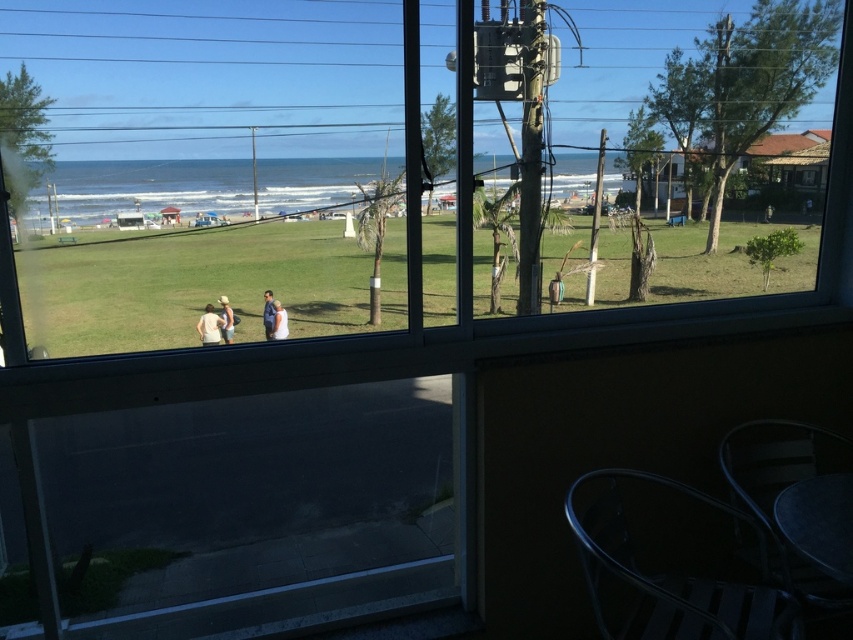
Between light brown fabric shirt at center and white cotton shirt at center, which one is positioned lower?

Positioned lower is light brown fabric shirt at center.

Who is positioned more to the right, light brown fabric shirt at center or white cotton shirt at center?

white cotton shirt at center

Which is in front, point (212, 305) or point (223, 333)?

Point (223, 333)

Locate an element on the screen. The width and height of the screenshot is (853, 640). light brown fabric shirt at center is located at coordinates (209, 326).

Who is taller, light brown fabric shirt at center or blue fabric jacket at center?

blue fabric jacket at center

What are the coordinates of `light brown fabric shirt at center` in the screenshot? It's located at (209, 326).

In the scene shown: Which is more to the right, green grassy field at center or white cotton shirt at center?

From the viewer's perspective, green grassy field at center appears more on the right side.

Looking at this image, between green grassy field at center and white cotton shirt at center, which one is positioned lower?

white cotton shirt at center is below.

Identify the location of green grassy field at center. Image resolution: width=853 pixels, height=640 pixels. (199, 284).